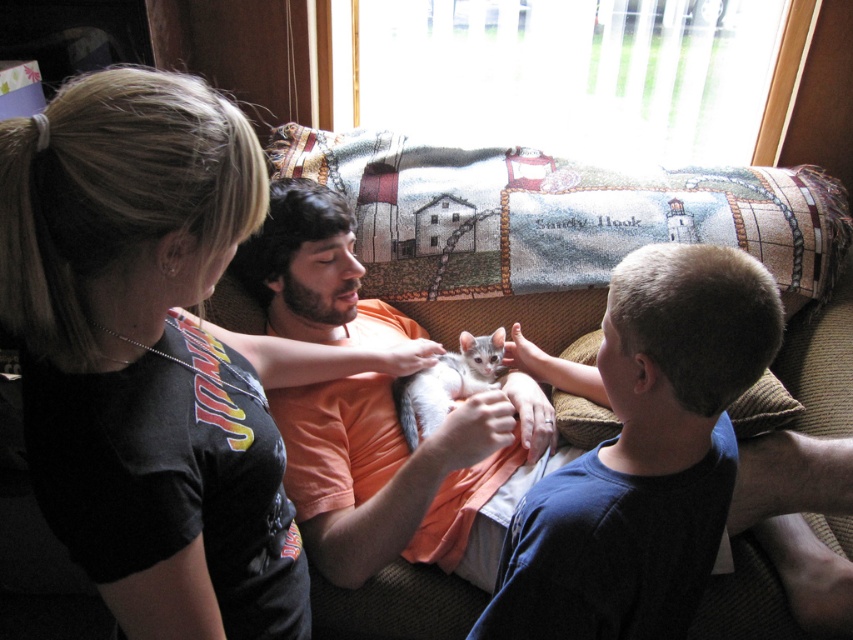
You are a photographer trying to capture a clear photo of the gray fur cat at center. However, the textured fabric couch at center is blocking your view. Can you move the couch to get a better shot?

The textured fabric couch at center is positioned over gray fur cat at center, so you cannot move the couch to get a better shot as the couch is blocking the cat entirely.

Based on the photo, you are a tailor measuring the smooth blue shirt at center and the textured fabric couch at center. Which item has a smaller width?

The smooth blue shirt at center has a smaller width than the textured fabric couch at center according to the description.

Consider the image. You are a delivery person who needs to place a large package on the couch. The package is as big as the gray fur cat at center. Can you fit the package on the textured fabric couch at center?

The textured fabric couch at center has a larger size compared to gray fur cat at center, so the package can fit on the textured fabric couch at center since it is bigger than the cat.